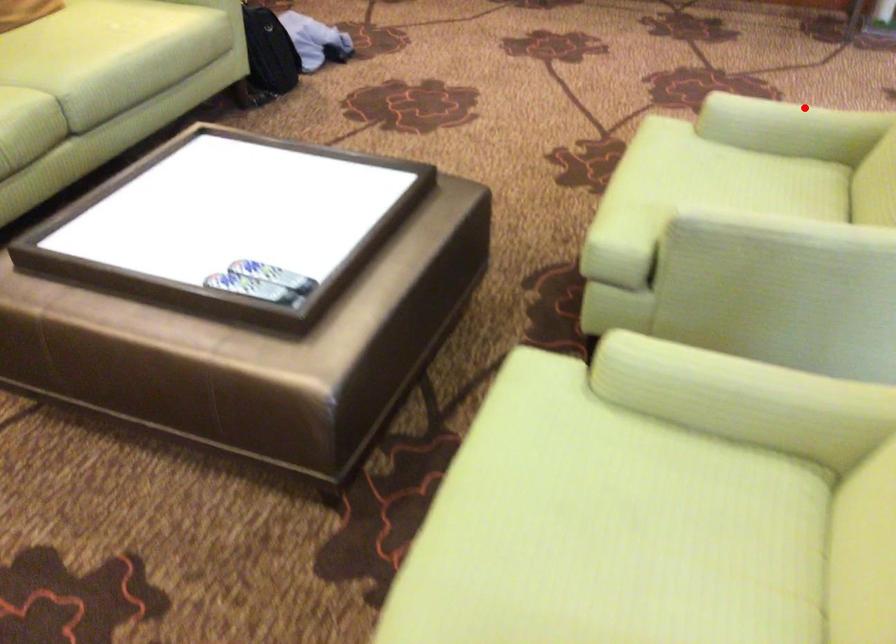
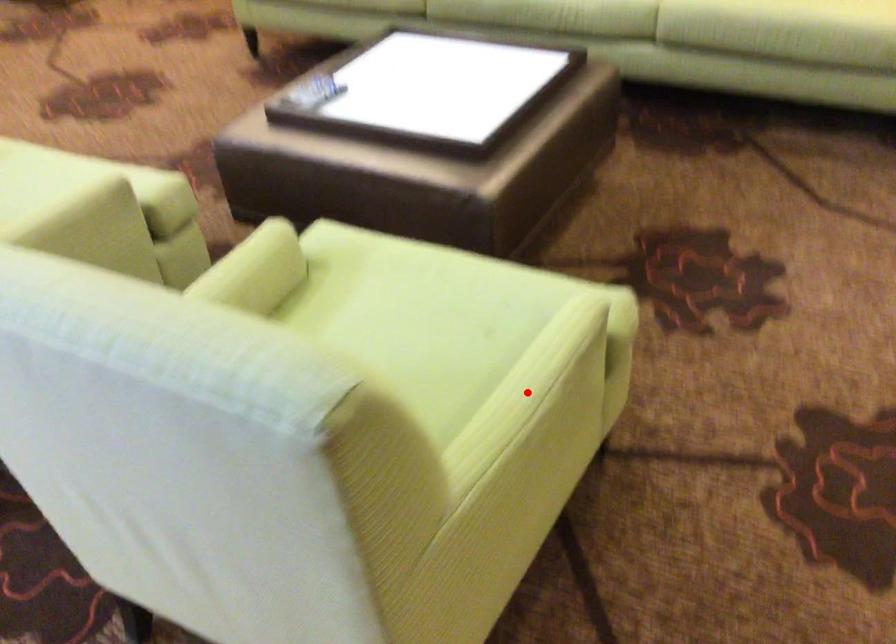
I am providing you with two images of the same scene from different viewpoints. A red point is marked on the first image and another point is marked on the second image. Are the points marked in image1 and image2 representing the same 3D position?

Yes